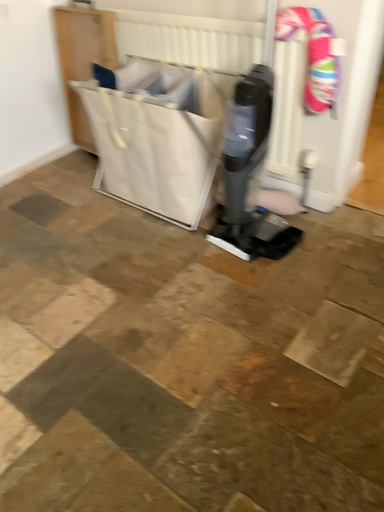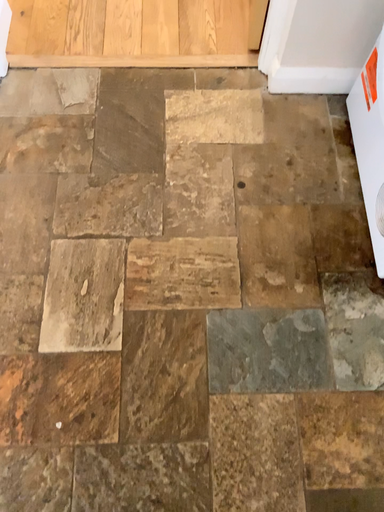
Question: Which way did the camera rotate in the video?

Choices:
 (A) rotated left
 (B) rotated right

Answer: (B)